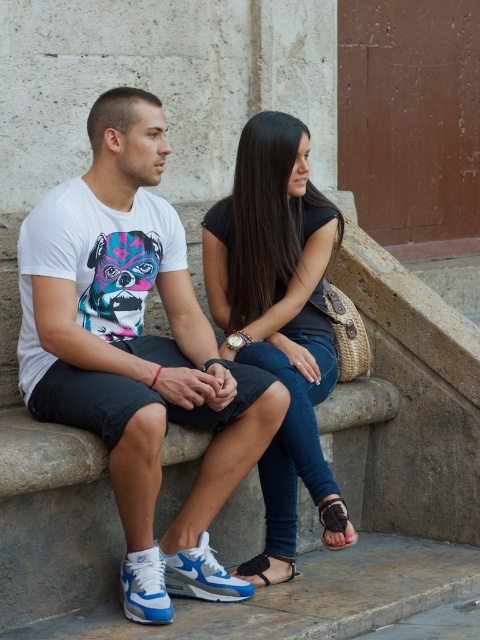
You are a photographer trying to capture a closeup of the brown leather sandal at lower center without the black matte jeans at center blocking the view. Is this possible given their positions?

The black matte jeans at center is further to the viewer than the brown leather sandal at lower center, so the jeans will block the sandal from view. You cannot capture a closeup of the brown leather sandal at lower center without the black matte jeans at center blocking the view.

You are a photographer trying to capture a candid shot of the two people sitting on the stone bench. You notice the black matte jeans at center and the black leather sandal at lower center. Which object is located to the right of the other?

The black matte jeans at center is positioned on the right side of black leather sandal at lower center.

You are a photographer trying to capture the scene of two people sitting on a stone bench. You need to ensure that both the black matte jeans at center and the brown leather sandal at lower center are visible in the frame. Based on their positions, which object should you focus on first to include both in the shot?

The black matte jeans at center is positioned on the left side of the brown leather sandal at lower center. To include both in the shot, focus on the black matte jeans at center first as it is closer to the left edge, ensuring the brown leather sandal at lower center remains within the frame.